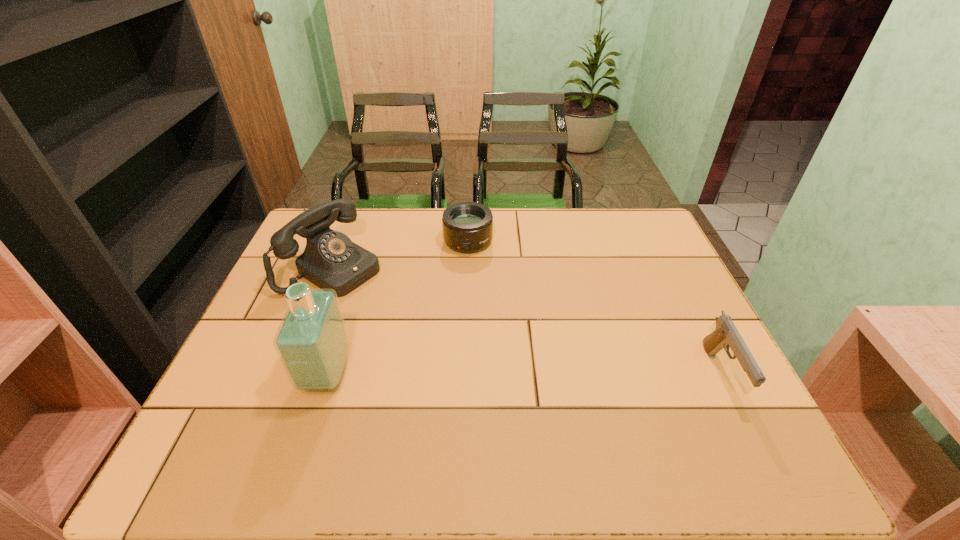
This screenshot has height=540, width=960. What are the coordinates of `vacant space located on the side of the third object from left to right with brand markings and control switches` in the screenshot? It's located at (473, 279).

Identify the location of blank area located 0.310m on the side of the third object from left to right with brand markings and control switches. (481, 335).

Identify the location of vacant space located 0.090m on the dial of the telephone. Image resolution: width=960 pixels, height=540 pixels. (388, 299).

I want to click on free space located on the dial of the telephone, so click(x=479, y=355).

This screenshot has width=960, height=540. In order to click on blank area located on the dial of the telephone in this screenshot , I will do `click(446, 335)`.

I want to click on telephoto lens that is at the far edge, so click(x=467, y=226).

Where is `telephone that is at the far edge`? The image size is (960, 540). telephone that is at the far edge is located at coordinates (331, 260).

The height and width of the screenshot is (540, 960). I want to click on perfume at the near edge, so click(312, 344).

Find the location of a particular element. pistol located at the near edge is located at coordinates (726, 335).

Where is `object at the left edge`? object at the left edge is located at coordinates [331, 260].